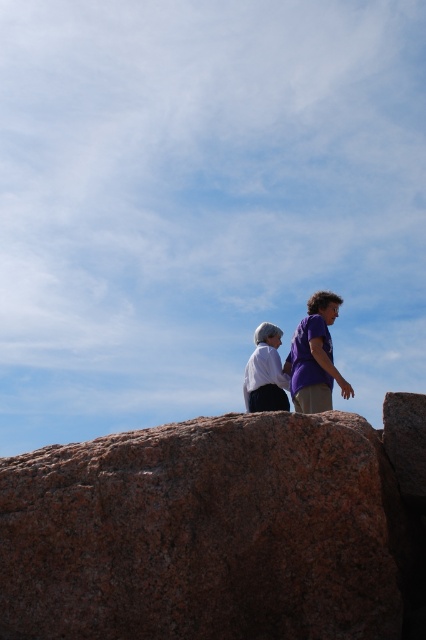
Does granite rock at center have a lesser width compared to purple matte shirt at center?

In fact, granite rock at center might be wider than purple matte shirt at center.

Which is behind, point (195, 461) or point (310, 305)?

The point (310, 305) is behind.

Between point (351, 522) and point (325, 304), which one is positioned in front?

Point (351, 522) is in front.

Locate an element on the screen. This screenshot has width=426, height=640. granite rock at center is located at coordinates (204, 532).

Between granite rock at center and white matte shirt at center, which one appears on the right side from the viewer's perspective?

From the viewer's perspective, white matte shirt at center appears more on the right side.

Identify the location of granite rock at center. This screenshot has width=426, height=640. (204, 532).

This screenshot has height=640, width=426. What are the coordinates of `granite rock at center` in the screenshot? It's located at (204, 532).

How much distance is there between purple matte shirt at center and white matte shirt at center?

purple matte shirt at center is 25.11 inches from white matte shirt at center.

The height and width of the screenshot is (640, 426). In order to click on purple matte shirt at center in this screenshot , I will do `click(314, 356)`.

Which is in front, point (313, 360) or point (282, 397)?

Point (313, 360) is more forward.

Identify the location of purple matte shirt at center. (314, 356).